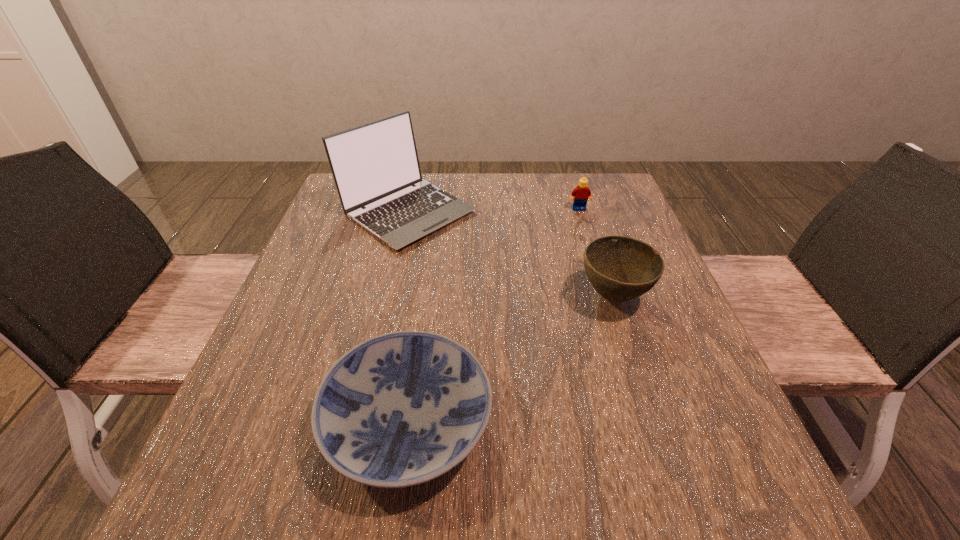
Identify the location of Lego located at the far edge. (582, 193).

Locate an element on the screen. The width and height of the screenshot is (960, 540). object present at the near edge is located at coordinates (400, 409).

The height and width of the screenshot is (540, 960). Find the location of `laptop_computer situated at the left edge`. laptop_computer situated at the left edge is located at coordinates (375, 166).

This screenshot has height=540, width=960. Identify the location of plate present at the left edge. (400, 409).

You are a GUI agent. You are given a task and a screenshot of the screen. Output one action in this format:
    pyautogui.click(x=<x>, y=<y>)
    Task: Click on the bowl located in the right edge section of the desktop
    The width and height of the screenshot is (960, 540).
    Given the screenshot: What is the action you would take?
    pyautogui.click(x=620, y=268)

Locate an element on the screen. This screenshot has width=960, height=540. Lego positioned at the right edge is located at coordinates (582, 193).

At what (x,y) coordinates should I click in order to perform the action: click on object situated at the far left corner. Please return your answer as a coordinate pair (x, y). Looking at the image, I should click on (375, 166).

Identify the location of object that is at the near left corner. (400, 409).

At what (x,y) coordinates should I click in order to perform the action: click on object located at the far right corner. Please return your answer as a coordinate pair (x, y). Image resolution: width=960 pixels, height=540 pixels. Looking at the image, I should click on (582, 193).

Identify the location of vacant space at the far edge of the desktop. The width and height of the screenshot is (960, 540). (540, 202).